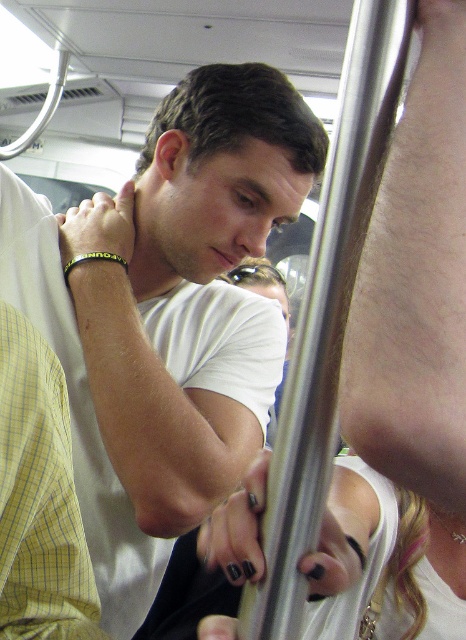
Looking at this image, you are standing at point A and want to move to point B in the subway scene. The coordinates for point A are point (109, 253) and point B are point (116, 227). According to the scene description, which point is closer to you?

Point (109, 253) is closer to you than point (116, 227) because the latter is behind the former.